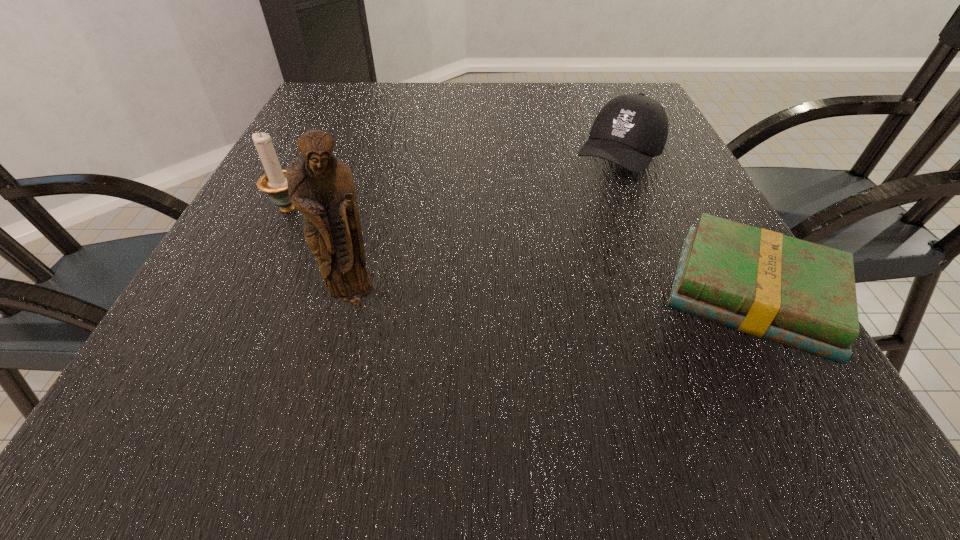
Locate an element on the screen. This screenshot has width=960, height=540. free region located on the handle side of the candle_holder is located at coordinates (369, 240).

Identify the location of blank area located 0.340m on the handle side of the candle_holder. This screenshot has height=540, width=960. (458, 278).

The image size is (960, 540). In order to click on vacant region located 0.090m on the front-facing side of the third tallest object in this screenshot , I will do [586, 207].

I want to click on free space located 0.390m on the front-facing side of the third tallest object, so click(x=510, y=306).

Find the location of a particular element. The width and height of the screenshot is (960, 540). vacant space located 0.170m on the front-facing side of the third tallest object is located at coordinates (569, 229).

Where is `object that is at the near edge`? object that is at the near edge is located at coordinates (800, 294).

Locate an element on the screen. This screenshot has width=960, height=540. object situated at the left edge is located at coordinates (274, 183).

Find the location of a particular element. This screenshot has width=960, height=540. book that is at the right edge is located at coordinates (800, 294).

This screenshot has width=960, height=540. Identify the location of baseball cap that is at the right edge. (630, 130).

Find the location of a particular element. object at the near right corner is located at coordinates (800, 294).